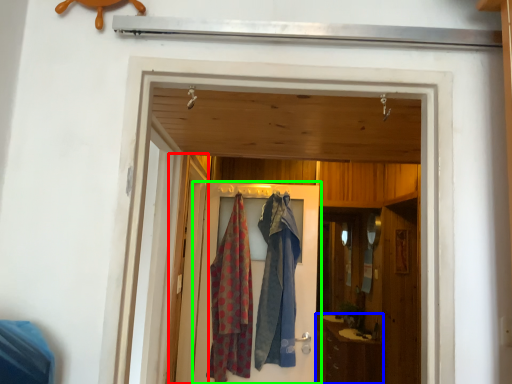
Question: Estimate the real-world distances between objects in this image. Which object is closer to screen door (highlighted by a red box), cabinetry (highlighted by a blue box) or door (highlighted by a green box)?

Choices:
 (A) cabinetry
 (B) door

Answer: (B)